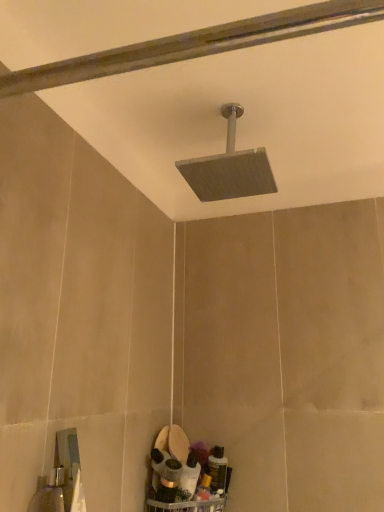
What do you see at coordinates (229, 168) in the screenshot? The height and width of the screenshot is (512, 384). I see `matte gray showerhead at upper center` at bounding box center [229, 168].

The image size is (384, 512). I want to click on matte gray showerhead at upper center, so click(x=229, y=168).

The height and width of the screenshot is (512, 384). I want to click on matte gray showerhead at upper center, so click(x=229, y=168).